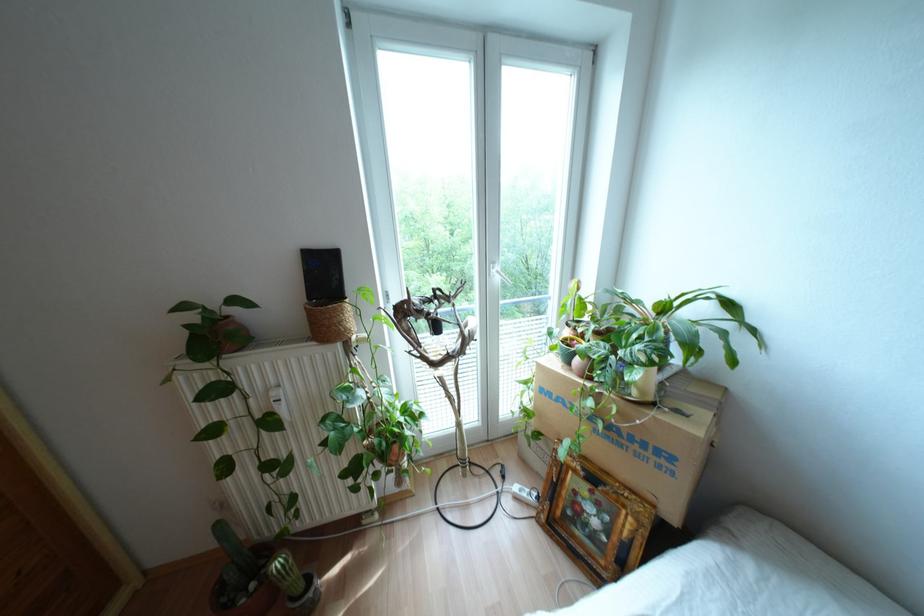
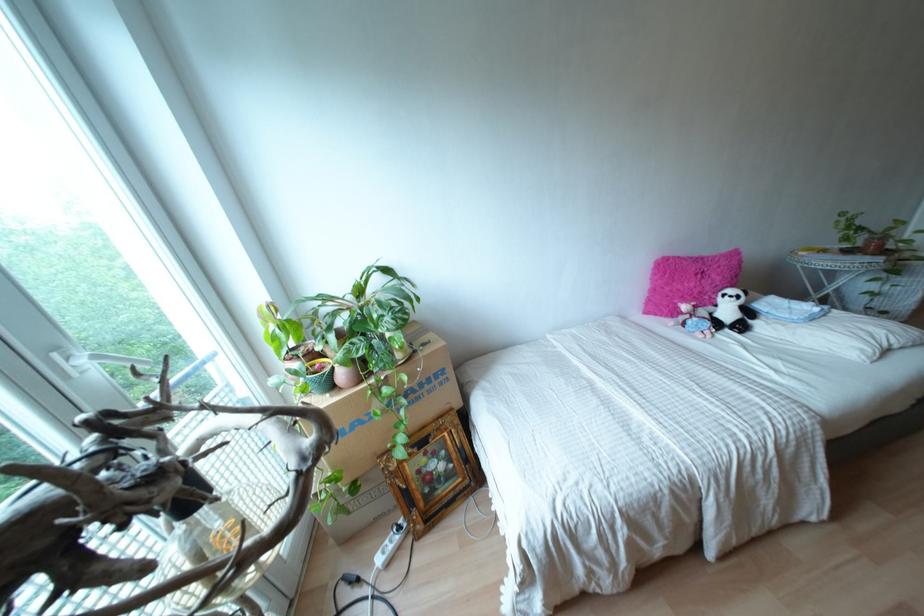
Locate, in the second image, the point that corresponds to point (576, 360) in the first image.

(342, 374)